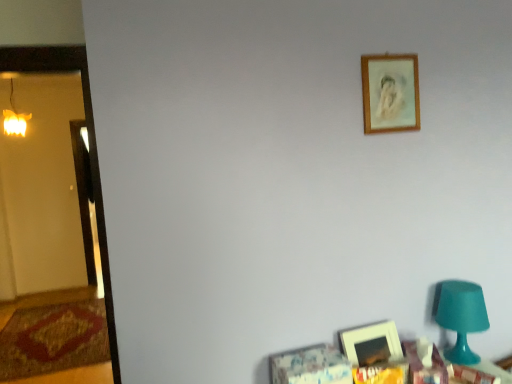
Describe the element at coordinates (15, 117) in the screenshot. I see `warm yellow glass at left` at that location.

Describe the element at coordinates (460, 316) in the screenshot. The image size is (512, 384). I see `teal plastic table lamp at lower right` at that location.

Locate an element on the screen. wooden frame at upper right, arranged as the 1th picture frame when viewed from the top is located at coordinates (390, 93).

I want to click on wooden table at lower right, so click(310, 366).

What are the coordinates of `warm yellow glass at left` in the screenshot? It's located at (15, 117).

The width and height of the screenshot is (512, 384). Identify the location of picture frame beneath the teal plastic table lamp at lower right (from a real-world perspective). (371, 343).

Is matte wooden picture frame at lower right, the 1th picture frame positioned from the bottom, taller or shorter than teal plastic table lamp at lower right?

In the image, matte wooden picture frame at lower right, the 1th picture frame positioned from the bottom, appears to be shorter than teal plastic table lamp at lower right.

Is matte wooden picture frame at lower right, the 1th picture frame positioned from the bottom, in front of or behind teal plastic table lamp at lower right in the image?

In the image, matte wooden picture frame at lower right, the 1th picture frame positioned from the bottom, appears behind teal plastic table lamp at lower right.

From the picture: Considering the sizes of wooden table at lower right and teal plastic table lamp at lower right in the image, is wooden table at lower right wider or thinner than teal plastic table lamp at lower right?

Considering their sizes, wooden table at lower right looks broader than teal plastic table lamp at lower right.

Choose the correct answer: Is wooden table at lower right inside teal plastic table lamp at lower right or outside it?

wooden table at lower right is located beyond the bounds of teal plastic table lamp at lower right.

Considering the positions of objects wooden table at lower right and teal plastic table lamp at lower right in the image provided, who is more to the right, wooden table at lower right or teal plastic table lamp at lower right?

teal plastic table lamp at lower right is more to the right.

Which object is further away from the camera, wooden table at lower right or teal plastic table lamp at lower right?

teal plastic table lamp at lower right is more distant.

There is a wooden table at lower right. What are the coordinates of `the 2nd picture frame above it (from a real-world perspective)` in the screenshot? It's located at (390, 93).

Which object is further away from the camera taking this photo, wooden frame at upper right, arranged as the 1th picture frame when viewed from the top, or wooden table at lower right?

Positioned behind is wooden frame at upper right, arranged as the 1th picture frame when viewed from the top.

Looking at this image, from a real-world perspective, is wooden frame at upper right, which is the second picture frame in bottom-to-top order, positioned over wooden table at lower right based on gravity?

Yes, from a real-world perspective, wooden frame at upper right, which is the second picture frame in bottom-to-top order, is above wooden table at lower right.

Is wooden frame at upper right, which is the second picture frame in bottom-to-top order, wider than wooden table at lower right?

Incorrect, the width of wooden frame at upper right, which is the second picture frame in bottom-to-top order, does not surpass that of wooden table at lower right.

Is teal plastic table lamp at lower right turned away from wooden frame at upper right, arranged as the 1th picture frame when viewed from the top?

No, teal plastic table lamp at lower right is not facing away from wooden frame at upper right, arranged as the 1th picture frame when viewed from the top.

Which of these two, teal plastic table lamp at lower right or wooden frame at upper right, arranged as the 1th picture frame when viewed from the top, stands shorter?

Standing shorter between the two is wooden frame at upper right, arranged as the 1th picture frame when viewed from the top.

From the picture: Can you confirm if teal plastic table lamp at lower right is smaller than wooden frame at upper right, which is the second picture frame in bottom-to-top order?

No, teal plastic table lamp at lower right is not smaller than wooden frame at upper right, which is the second picture frame in bottom-to-top order.

What's the angular difference between teal plastic table lamp at lower right and wooden frame at upper right, arranged as the 1th picture frame when viewed from the top,'s facing directions?

The facing directions of teal plastic table lamp at lower right and wooden frame at upper right, arranged as the 1th picture frame when viewed from the top, are 2.24 degrees apart.

Does matte wooden picture frame at lower right, the 2th picture frame when ordered from top to bottom, have a lesser height compared to wooden table at lower right?

No.

Between matte wooden picture frame at lower right, the 1th picture frame positioned from the bottom, and wooden table at lower right, which one has larger width?

wooden table at lower right is wider.

From the wooden table at lower right, count the 2nd picture frame to the left and point to it. Please provide its 2D coordinates.

[(371, 343)]

Is matte wooden picture frame at lower right, the 2th picture frame when ordered from top to bottom, far from wooden table at lower right?

No, matte wooden picture frame at lower right, the 2th picture frame when ordered from top to bottom, is not far from wooden table at lower right.

From a real-world perspective, which object rests below the other?

teal plastic table lamp at lower right is physically lower.

Identify the location of picture frame positioned vertically above the teal plastic table lamp at lower right (from a real-world perspective). The height and width of the screenshot is (384, 512). (390, 93).

Is wooden frame at upper right, arranged as the 1th picture frame when viewed from the top, bigger than teal plastic table lamp at lower right?

No, wooden frame at upper right, arranged as the 1th picture frame when viewed from the top, is not bigger than teal plastic table lamp at lower right.

From the image's perspective, who appears lower, warm yellow glass at left or teal plastic table lamp at lower right?

teal plastic table lamp at lower right appears lower in the image.

Considering the relative sizes of warm yellow glass at left and teal plastic table lamp at lower right in the image provided, is warm yellow glass at left smaller than teal plastic table lamp at lower right?

Incorrect, warm yellow glass at left is not smaller in size than teal plastic table lamp at lower right.

Does warm yellow glass at left have a greater width compared to teal plastic table lamp at lower right?

Indeed, warm yellow glass at left has a greater width compared to teal plastic table lamp at lower right.

Between point (12, 132) and point (481, 307), which one is positioned in front?

The point (481, 307) is more forward.

At what (x,y) coordinates should I click in order to perform the action: click on table lamp lying in front of the matte wooden picture frame at lower right, the 2th picture frame when ordered from top to bottom. Please return your answer as a coordinate pair (x, y). Image resolution: width=512 pixels, height=384 pixels. Looking at the image, I should click on (460, 316).

The width and height of the screenshot is (512, 384). I want to click on table lamp behind the wooden table at lower right, so click(460, 316).

Looking at the image, which one is located further to matte wooden picture frame at lower right, the 1th picture frame positioned from the bottom, wooden table at lower right or warm yellow glass at left?

warm yellow glass at left is further to matte wooden picture frame at lower right, the 1th picture frame positioned from the bottom.

From the image, which object appears to be nearer to wooden table at lower right, teal plastic table lamp at lower right or matte wooden picture frame at lower right, the 2th picture frame when ordered from top to bottom?

matte wooden picture frame at lower right, the 2th picture frame when ordered from top to bottom, is positioned closer to the anchor wooden table at lower right.

Based on their spatial positions, is teal plastic table lamp at lower right or warm yellow glass at left closer to wooden table at lower right?

teal plastic table lamp at lower right is closer to wooden table at lower right.

Which object lies further to the anchor point matte wooden picture frame at lower right, the 2th picture frame when ordered from top to bottom, warm yellow glass at left or wooden table at lower right?

Based on the image, warm yellow glass at left appears to be further to matte wooden picture frame at lower right, the 2th picture frame when ordered from top to bottom.

Looking at the image, which one is located closer to teal plastic table lamp at lower right, wooden table at lower right or warm yellow glass at left?

Among the two, wooden table at lower right is located nearer to teal plastic table lamp at lower right.

Considering their positions, is wooden table at lower right positioned closer to matte wooden picture frame at lower right, the 1th picture frame positioned from the bottom, than wooden frame at upper right, which is the second picture frame in bottom-to-top order?

wooden table at lower right is positioned closer to the anchor matte wooden picture frame at lower right, the 1th picture frame positioned from the bottom.

Which object lies further to the anchor point matte wooden picture frame at lower right, the 1th picture frame positioned from the bottom, wooden table at lower right or teal plastic table lamp at lower right?

teal plastic table lamp at lower right is further to matte wooden picture frame at lower right, the 1th picture frame positioned from the bottom.

From the image, which object appears to be farther from wooden frame at upper right, which is the second picture frame in bottom-to-top order, teal plastic table lamp at lower right or warm yellow glass at left?

warm yellow glass at left is positioned further to the anchor wooden frame at upper right, which is the second picture frame in bottom-to-top order.

Where is `furniture between matte wooden picture frame at lower right, the 2th picture frame when ordered from top to bottom, and teal plastic table lamp at lower right from left to right`? furniture between matte wooden picture frame at lower right, the 2th picture frame when ordered from top to bottom, and teal plastic table lamp at lower right from left to right is located at coordinates (310, 366).

Locate an element on the screen. The height and width of the screenshot is (384, 512). table lamp between wooden frame at upper right, arranged as the 1th picture frame when viewed from the top, and wooden table at lower right from top to bottom is located at coordinates [x=460, y=316].

Find the location of a particular element. This screenshot has width=512, height=384. picture frame situated between warm yellow glass at left and wooden frame at upper right, which is the second picture frame in bottom-to-top order, from left to right is located at coordinates (371, 343).

Locate an element on the screen. The image size is (512, 384). picture frame between wooden frame at upper right, arranged as the 1th picture frame when viewed from the top, and wooden table at lower right, in the vertical direction is located at coordinates (371, 343).